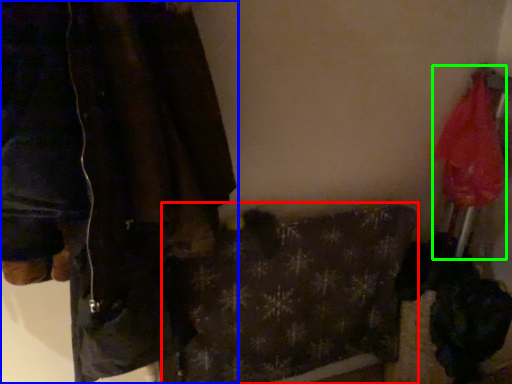
Question: Which is nearer to the blanket (highlighted by a red box)? jacket (highlighted by a blue box) or umbrella (highlighted by a green box).

Choices:
 (A) jacket
 (B) umbrella

Answer: (A)